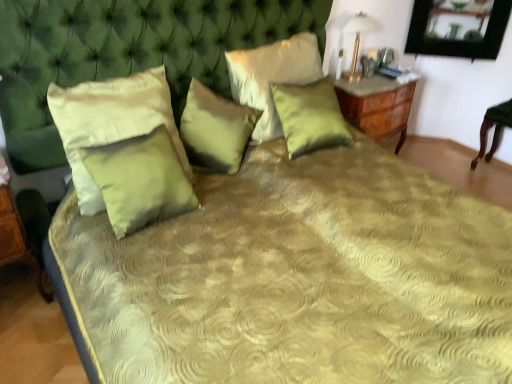
Question: Is green satin pillow at upper center, the first pillow in the right-to-left sequence, taller or shorter than satin green pillow at center, which is the 3th pillow from right to left?

Choices:
 (A) tall
 (B) short

Answer: (A)

Question: From a real-world perspective, is green satin pillow at upper center, the first pillow in the right-to-left sequence, above or below satin green pillow at center, which is the 3th pillow from right to left?

Choices:
 (A) below
 (B) above

Answer: (B)

Question: Which is farther from the wooden table at lower left?

Choices:
 (A) satin green pillow at center, positioned as the third pillow in left-to-right order
 (B) satin green pillow at center, the fourth pillow viewed from the right
 (C) matte green pillow at left, arranged as the 1th pillow when viewed from the left
 (D) gold metallic table lamp at upper right
 (E) wooden nightstand at right

Answer: (D)

Question: Estimate the real-world distances between objects in this image. Which object is closer to the wooden table at lower left?

Choices:
 (A) matte green pillow at left, the fifth pillow viewed from the right
 (B) green satin pillow at upper center, the first pillow in the right-to-left sequence
 (C) wooden nightstand at right
 (D) satin green pillow at center, positioned as the third pillow in left-to-right order
 (E) satin green pillow at upper center, which is counted as the second pillow, starting from the right

Answer: (A)